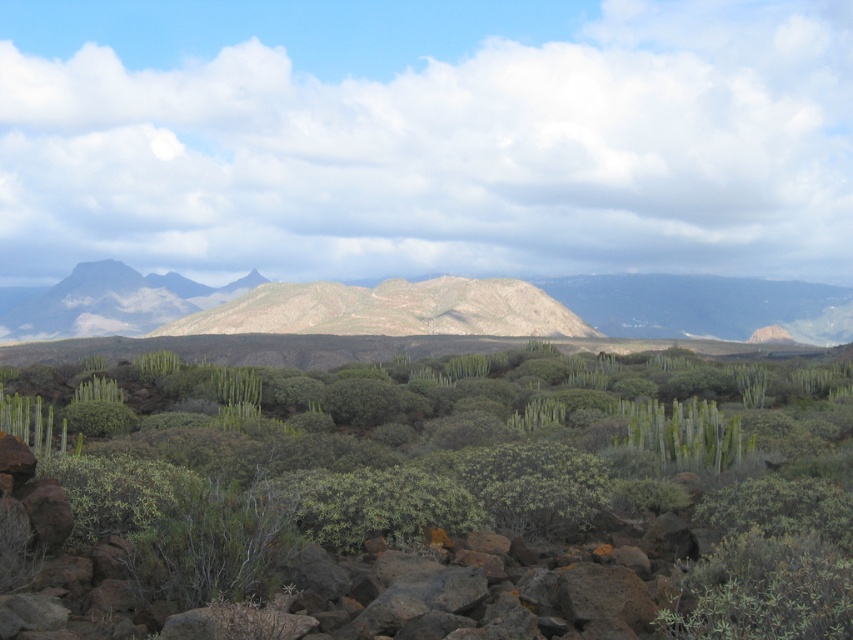
Question: Can you confirm if brown/dry soil at center is wider than green spiky cactus at center?

Choices:
 (A) no
 (B) yes

Answer: (B)

Question: Can you confirm if brown/dry soil at center is positioned to the left of green spiky cactus at center?

Choices:
 (A) yes
 (B) no

Answer: (A)

Question: Does brown/dry soil at center appear over green spiky cactus at center?

Choices:
 (A) yes
 (B) no

Answer: (A)

Question: Which point is farther to the camera?

Choices:
 (A) brown/dry soil at center
 (B) green spiky cactus at center

Answer: (A)

Question: Among these points, which one is nearest to the camera?

Choices:
 (A) (697, 465)
 (B) (819, 340)

Answer: (A)